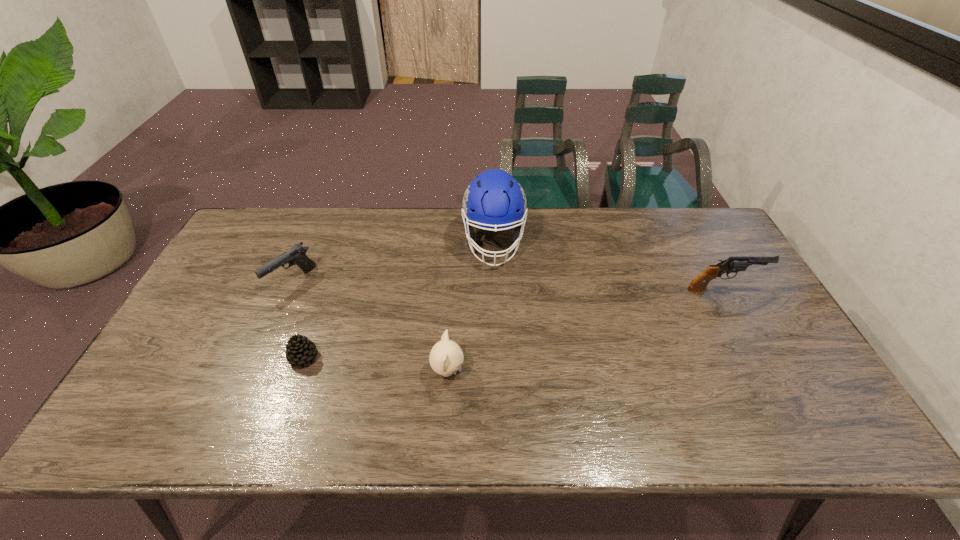
Find the location of a particular element. The width and height of the screenshot is (960, 540). free area in between the kitten and the second tallest object is located at coordinates (586, 330).

Locate an element on the screen. empty location between the leftmost object and the fourth shortest object is located at coordinates (508, 286).

Where is `vacant area that lies between the kitten and the football helmet`? The image size is (960, 540). vacant area that lies between the kitten and the football helmet is located at coordinates 470,307.

This screenshot has height=540, width=960. In order to click on free spot between the pinecone and the shorter gun in this screenshot , I will do point(298,320).

Locate an element on the screen. This screenshot has height=540, width=960. free space between the tallest object and the kitten is located at coordinates (470, 307).

At what (x,y) coordinates should I click in order to perform the action: click on vacant region between the football helmet and the kitten. Please return your answer as a coordinate pair (x, y). Looking at the image, I should click on (470, 307).

What are the coordinates of `vacant space that is in between the left gun and the fourth object from right to left` in the screenshot? It's located at (298, 320).

Identify the location of vacant space that's between the left gun and the tallest object. (393, 262).

Image resolution: width=960 pixels, height=540 pixels. Identify the location of free space between the rightmost object and the tallest object. (609, 266).

Locate which object is the closest to the taller gun. Please provide its 2D coordinates. Your answer should be formatted as a tuple, i.e. [(x, y)], where the tuple contains the x and y coordinates of a point satisfying the conditions above.

[(494, 199)]